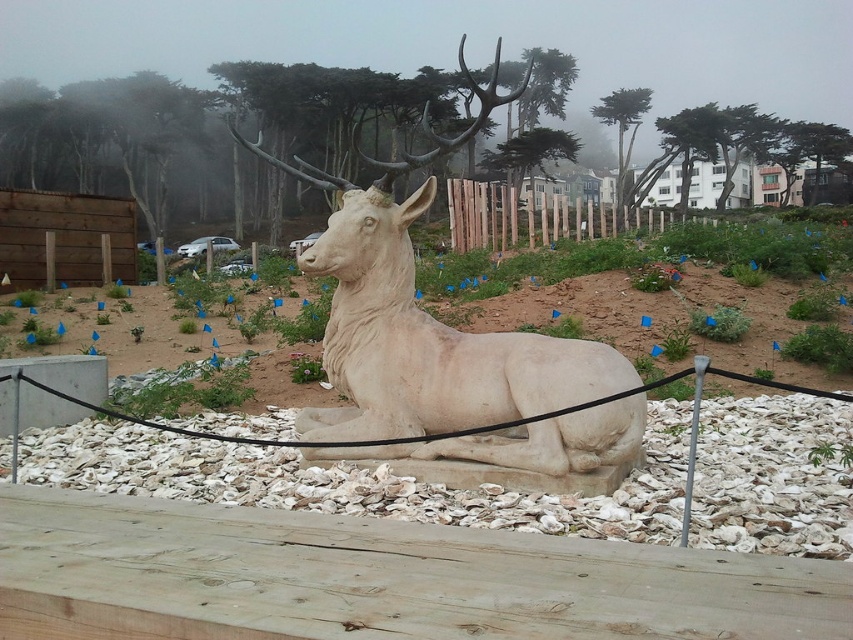
Question: Does white gravel at center have a larger size compared to white stone sculpture at center?

Choices:
 (A) no
 (B) yes

Answer: (A)

Question: Is white gravel at center above white stone sculpture at center?

Choices:
 (A) no
 (B) yes

Answer: (A)

Question: Which object is closer to the camera taking this photo?

Choices:
 (A) white stone sculpture at center
 (B) white gravel at center

Answer: (B)

Question: Which object is closer to the camera taking this photo?

Choices:
 (A) white gravel at center
 (B) white stone sculpture at center

Answer: (A)

Question: In this image, where is white gravel at center located relative to white stone sculpture at center?

Choices:
 (A) above
 (B) below

Answer: (B)

Question: Which object appears farthest from the camera in this image?

Choices:
 (A) white gravel at center
 (B) white stone sculpture at center

Answer: (B)